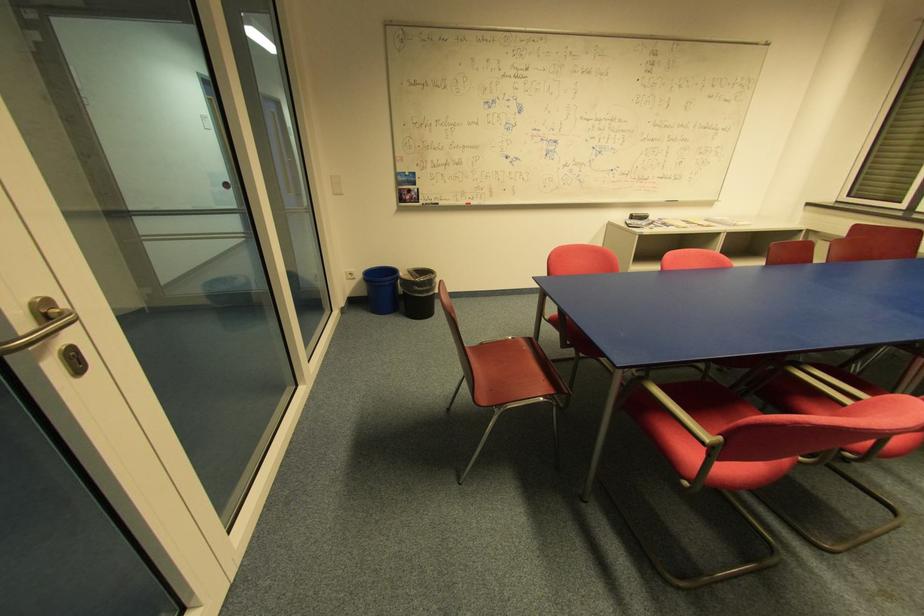
Image resolution: width=924 pixels, height=616 pixels. Describe the element at coordinates (511, 371) in the screenshot. I see `the red chair sitting surface` at that location.